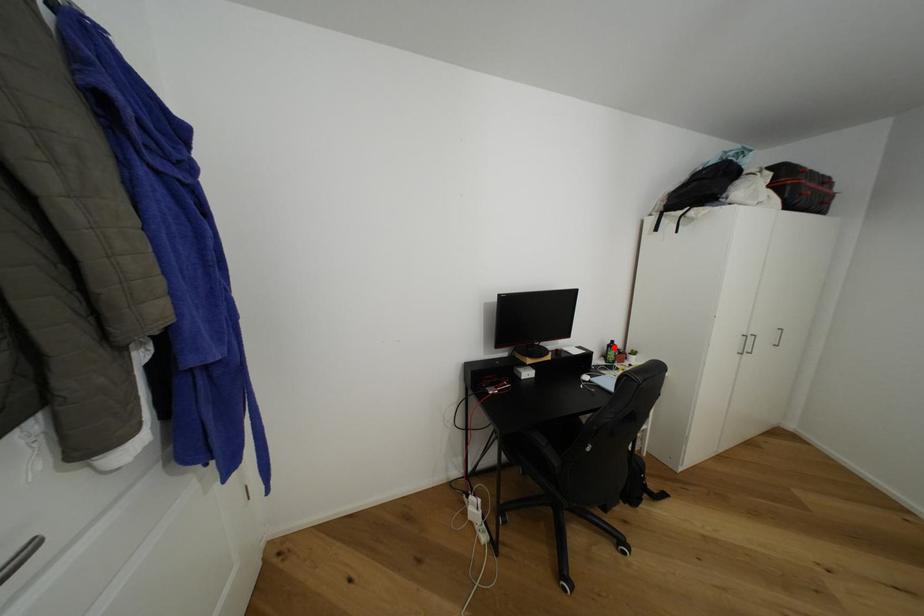
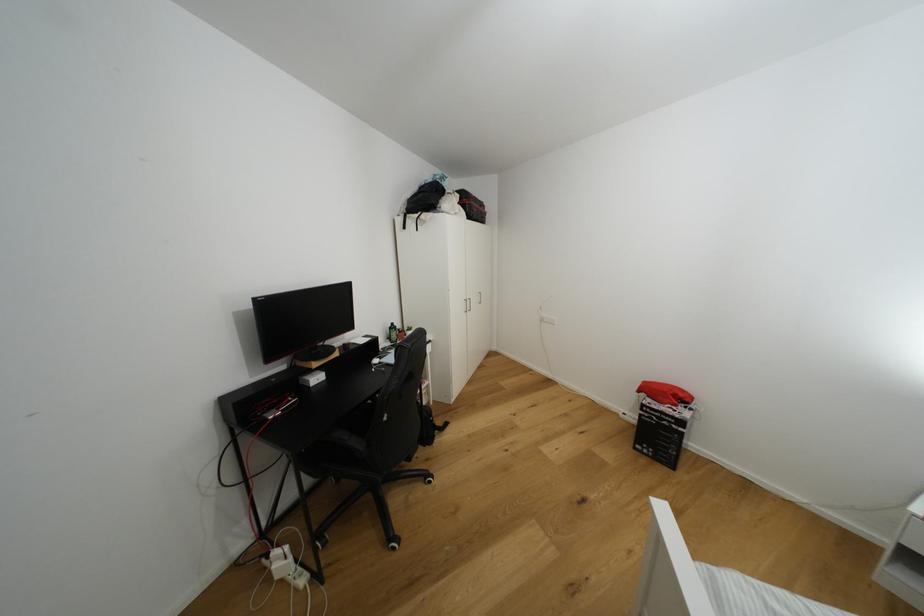
In the second image, find the point that corresponds to the highlighted location in the first image.

(395, 330)